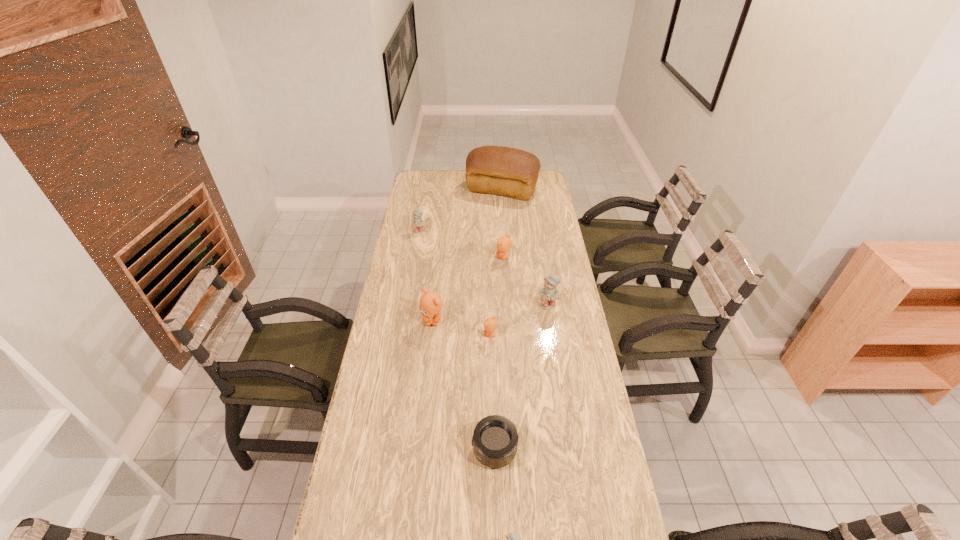
Image resolution: width=960 pixels, height=540 pixels. I want to click on the second brown teddy bear from left to right, so click(x=490, y=324).

The height and width of the screenshot is (540, 960). I want to click on the sixth farthest object, so click(x=490, y=324).

Identify the location of the seventh farthest object. (495, 439).

This screenshot has height=540, width=960. Identify the location of free location located 0.220m on the left of the bread. (425, 190).

I want to click on vacant region located on the front-facing side of the biggest blue teddy bear, so click(552, 325).

Locate an element on the screen. The height and width of the screenshot is (540, 960). vacant region located on the face of the second farthest brown teddy bear is located at coordinates (423, 403).

The width and height of the screenshot is (960, 540). I want to click on free region located 0.320m on the face of the second biggest brown teddy bear, so click(424, 257).

Image resolution: width=960 pixels, height=540 pixels. I want to click on vacant space located 0.310m on the face of the second biggest brown teddy bear, so click(x=427, y=257).

I want to click on free space located 0.140m on the face of the second biggest brown teddy bear, so click(465, 257).

The height and width of the screenshot is (540, 960). Find the location of `vacant space situated 0.370m on the front-facing side of the second biggest blue teddy bear`. vacant space situated 0.370m on the front-facing side of the second biggest blue teddy bear is located at coordinates (410, 288).